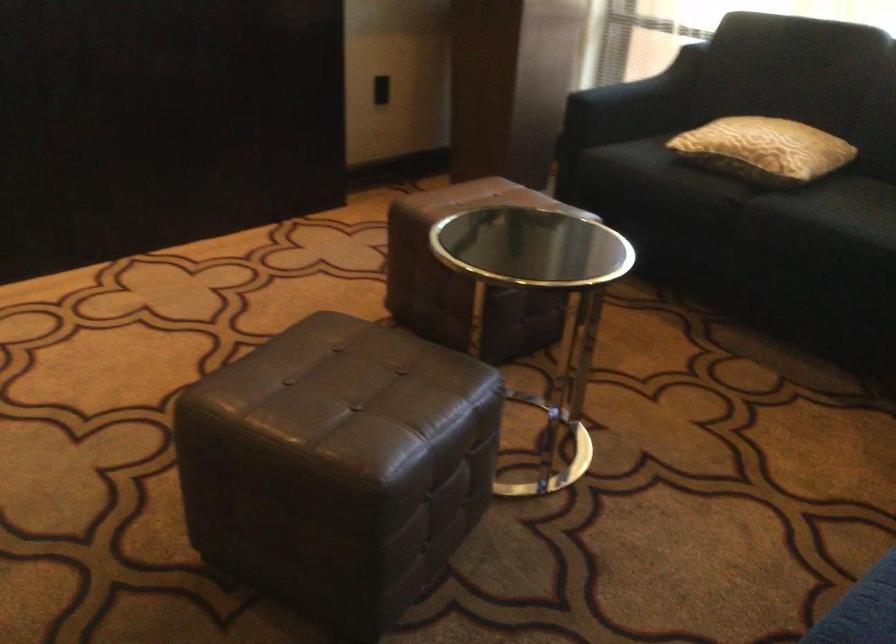
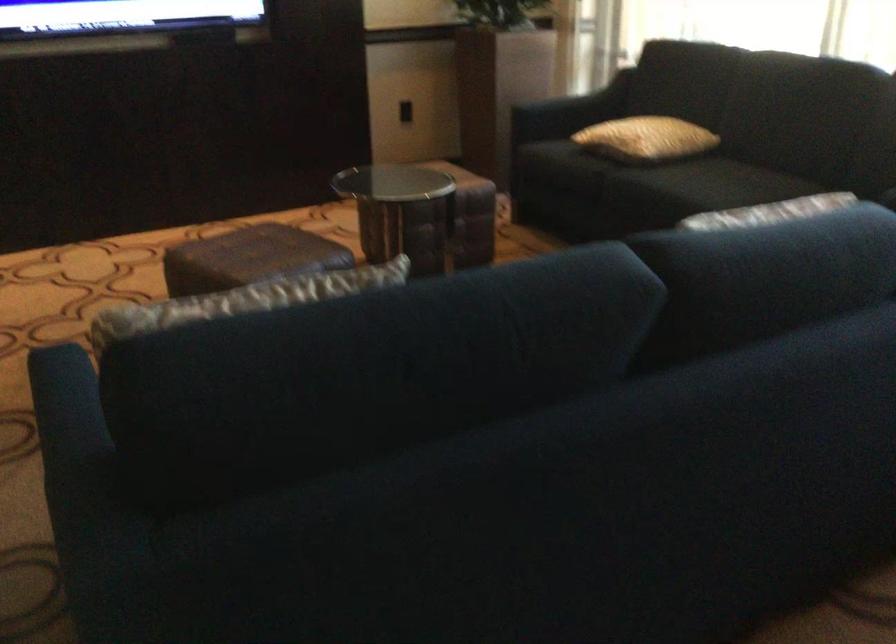
In the second image, find the point that corresponds to the point at 791,154 in the first image.

(645, 138)